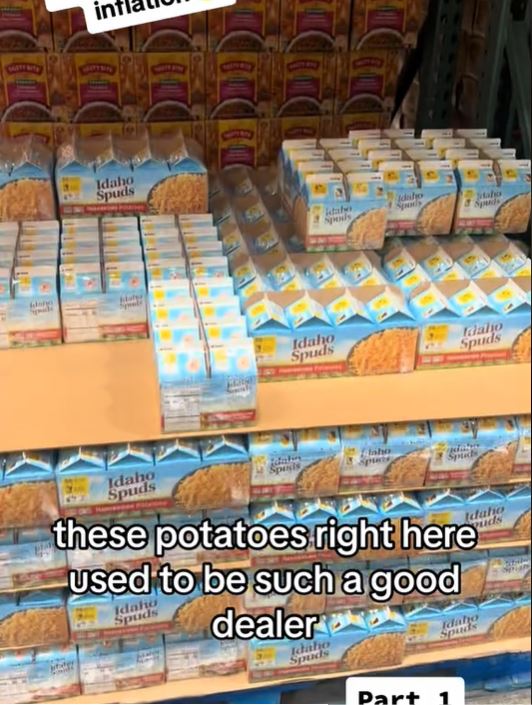
The width and height of the screenshot is (532, 705). I want to click on middle shelf, so click(x=195, y=680).